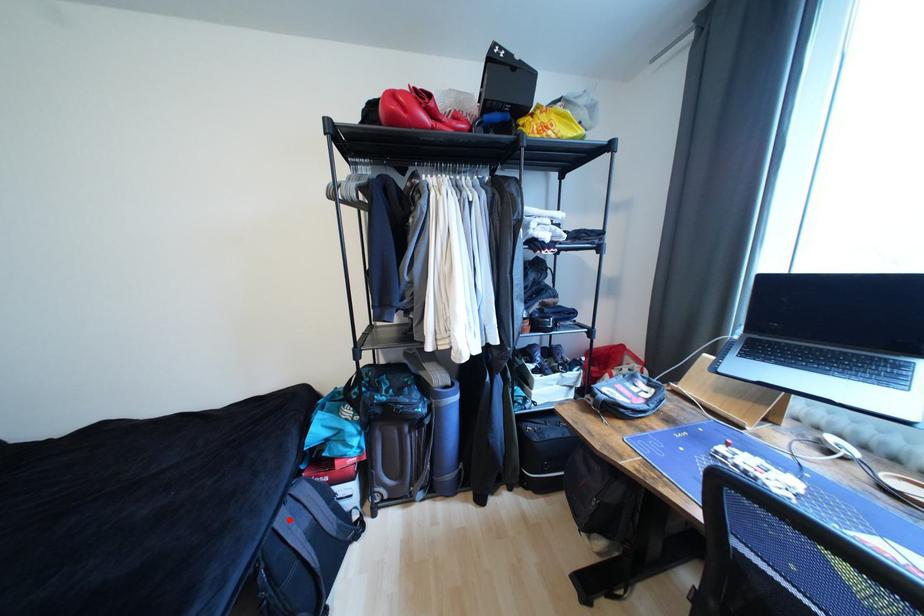
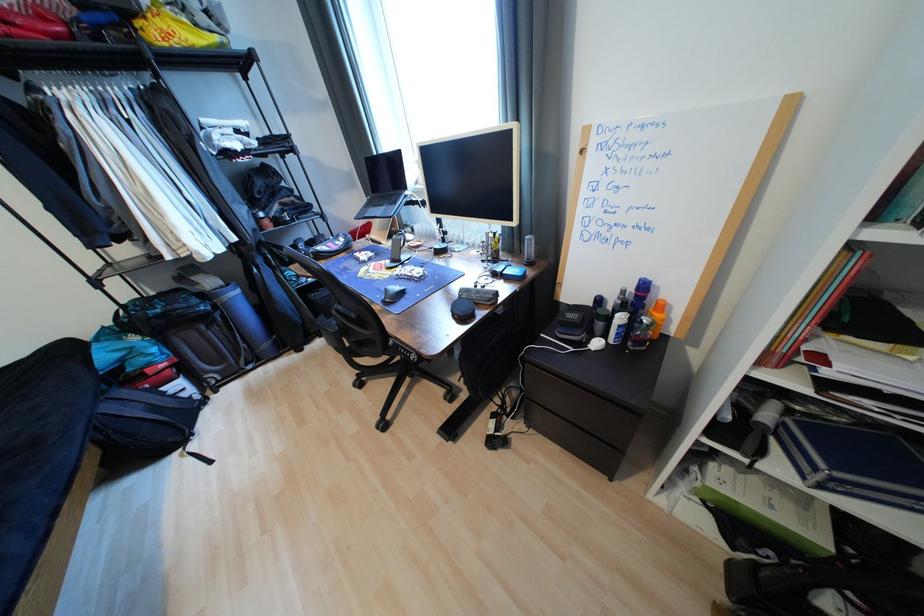
Find the pixel in the second image that matches the highlighted location in the first image.

(116, 408)